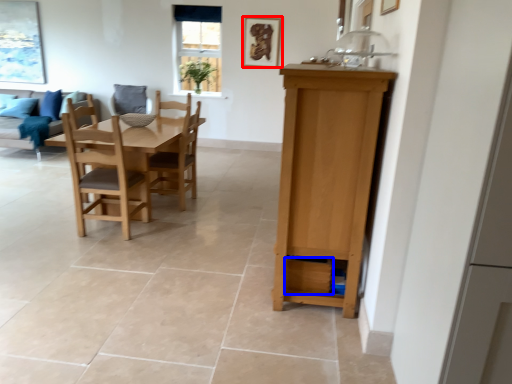
Question: Among these objects, which one is nearest to the camera, picture frame (highlighted by a red box) or drawer (highlighted by a blue box)?

Choices:
 (A) picture frame
 (B) drawer

Answer: (B)